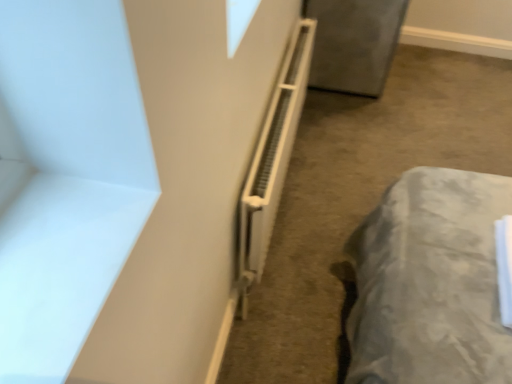
The width and height of the screenshot is (512, 384). Find the location of `spots to the right of white matte radiator at center`. spots to the right of white matte radiator at center is located at coordinates (333, 185).